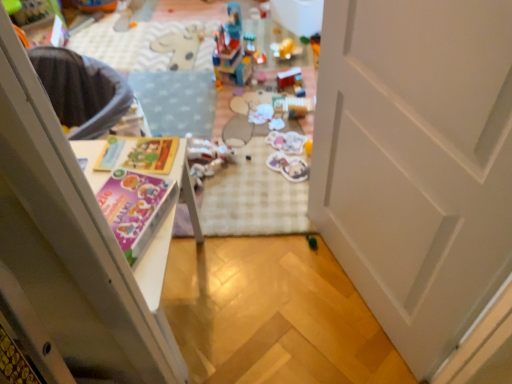
What are the coordinates of `vacant region in front of matte plastic stickers at center, the second toy from the bottom` in the screenshot? It's located at (281, 194).